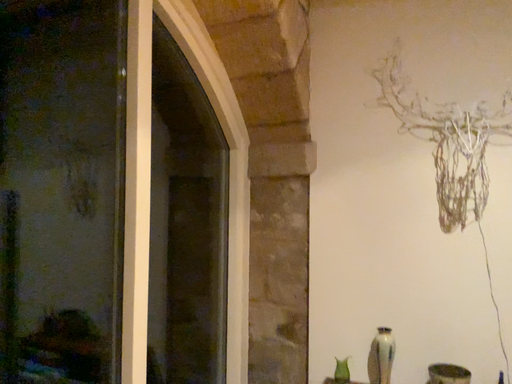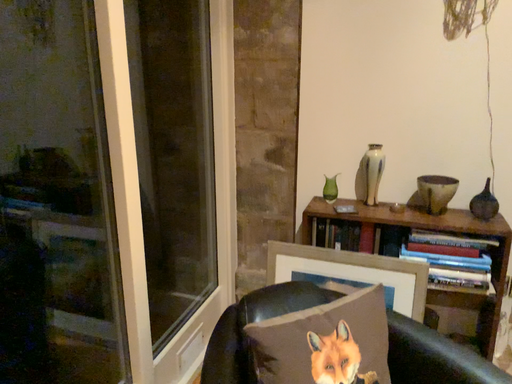
Question: Which way did the camera rotate in the video?

Choices:
 (A) rotated upward
 (B) rotated downward

Answer: (B)